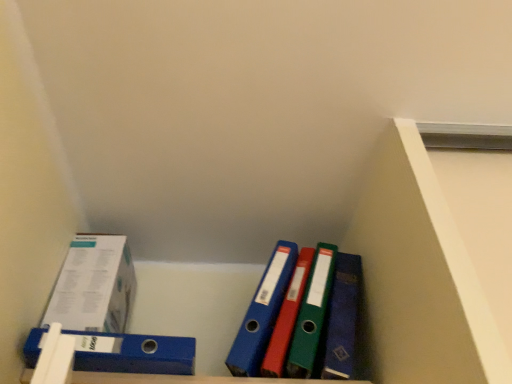
You are a GUI agent. You are given a task and a screenshot of the screen. Output one action in this format:
    pyautogui.click(x=<x>, y=<y>)
    Task: Click on the white paperboard box at left
    The height and width of the screenshot is (384, 512).
    Given the screenshot: What is the action you would take?
    pyautogui.click(x=93, y=285)

The image size is (512, 384). What do you see at coordinates (93, 285) in the screenshot?
I see `white paperboard box at left` at bounding box center [93, 285].

Describe the element at coordinates (133, 353) in the screenshot. I see `blue plastic binder at lower left` at that location.

Measure the distance between blue plastic binder at lower left and camera.

24.13 inches.

At what (x,y) coordinates should I click in order to perform the action: click on blue plastic binder at lower left. Please return your answer as a coordinate pair (x, y). The width and height of the screenshot is (512, 384). Looking at the image, I should click on (133, 353).

Image resolution: width=512 pixels, height=384 pixels. I want to click on white paperboard box at left, so click(x=93, y=285).

Which is more to the right, white paperboard box at left or blue plastic binder at lower left?

From the viewer's perspective, blue plastic binder at lower left appears more on the right side.

Is white paperboard box at left in front of or behind blue plastic binder at lower left in the image?

white paperboard box at left is behind blue plastic binder at lower left.

Which is nearer, [89,292] or [161,364]?

Clearly, point [89,292] is more distant from the camera than point [161,364].

From the image's perspective, does white paperboard box at left appear lower than blue plastic binder at lower left?

No.

From a real-world perspective, is white paperboard box at left physically below blue plastic binder at lower left?

No, from a real-world perspective, white paperboard box at left is not beneath blue plastic binder at lower left.

Which of these two, white paperboard box at left or blue plastic binder at lower left, is wider?

blue plastic binder at lower left.

From their relative heights in the image, would you say white paperboard box at left is taller or shorter than blue plastic binder at lower left?

white paperboard box at left is taller than blue plastic binder at lower left.

Can you confirm if white paperboard box at left is bigger than blue plastic binder at lower left?

Indeed, white paperboard box at left has a larger size compared to blue plastic binder at lower left.

Which is correct: white paperboard box at left is inside blue plastic binder at lower left, or outside of it?

white paperboard box at left is outside blue plastic binder at lower left.

Is white paperboard box at left beside blue plastic binder at lower left?

white paperboard box at left and blue plastic binder at lower left are clearly separated.

Is white paperboard box at left oriented away from blue plastic binder at lower left?

No.

How different are the orientations of white paperboard box at left and blue plastic binder at lower left in degrees?

0.0824 degrees separate the facing orientations of white paperboard box at left and blue plastic binder at lower left.

The image size is (512, 384). I want to click on box on the left of blue plastic binder at lower left, so click(93, 285).

Considering the relative positions of blue plastic binder at lower left and white paperboard box at left in the image provided, is blue plastic binder at lower left to the right of white paperboard box at left from the viewer's perspective?

Yes.

Which is behind, blue plastic binder at lower left or white paperboard box at left?

white paperboard box at left.

Which is nearer, (115, 364) or (102, 257)?

The point (115, 364) is closer.

From the image's perspective, is blue plastic binder at lower left beneath white paperboard box at left?

Yes, from the image's perspective, blue plastic binder at lower left is beneath white paperboard box at left.

From a real-world perspective, which object stands above the other?

white paperboard box at left, from a real-world perspective.

Is blue plastic binder at lower left wider than white paperboard box at left?

Yes.

Considering the relative sizes of blue plastic binder at lower left and white paperboard box at left in the image provided, is blue plastic binder at lower left taller than white paperboard box at left?

No, blue plastic binder at lower left is not taller than white paperboard box at left.

Considering the sizes of objects blue plastic binder at lower left and white paperboard box at left in the image provided, who is bigger, blue plastic binder at lower left or white paperboard box at left?

white paperboard box at left is bigger.

Is blue plastic binder at lower left not within white paperboard box at left?

Yes, blue plastic binder at lower left is not within white paperboard box at left.

Based on the photo, are blue plastic binder at lower left and white paperboard box at left beside each other?

No, blue plastic binder at lower left is not touching white paperboard box at left.

Is blue plastic binder at lower left oriented away from white paperboard box at left?

No, white paperboard box at left is not at the back of blue plastic binder at lower left.

Can you tell me how much blue plastic binder at lower left and white paperboard box at left differ in facing direction?

The angle between the facing direction of blue plastic binder at lower left and the facing direction of white paperboard box at left is 0.0824 degrees.

Where is `box positioned vertically above the blue plastic binder at lower left (from a real-world perspective)`? The width and height of the screenshot is (512, 384). box positioned vertically above the blue plastic binder at lower left (from a real-world perspective) is located at coordinates (93, 285).

I want to click on binder below the white paperboard box at left (from a real-world perspective), so click(x=133, y=353).

Locate an element on the screen. This screenshot has height=384, width=512. binder in front of the white paperboard box at left is located at coordinates (133, 353).